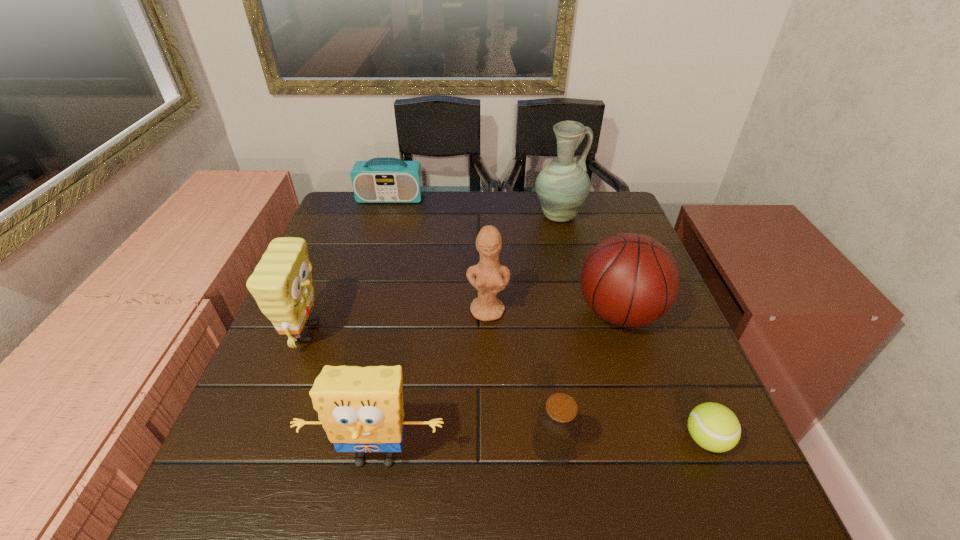
I want to click on pitcher located in the right edge section of the desktop, so [x=562, y=186].

At what (x,y) coordinates should I click in order to perform the action: click on basketball present at the right edge. Please return your answer as a coordinate pair (x, y). The height and width of the screenshot is (540, 960). Looking at the image, I should click on (628, 279).

Identify the location of tennis ball at the right edge. Image resolution: width=960 pixels, height=540 pixels. (714, 427).

I want to click on object at the far left corner, so click(x=380, y=180).

The width and height of the screenshot is (960, 540). I want to click on object at the near left corner, so click(x=361, y=409).

The width and height of the screenshot is (960, 540). I want to click on object that is at the far right corner, so tap(562, 186).

The image size is (960, 540). Find the location of `free location at the far edge`. free location at the far edge is located at coordinates (469, 227).

In the image, there is a desktop. In order to click on vacant space at the near edge in this screenshot , I will do `click(503, 527)`.

In the image, there is a desktop. Where is `vacant space at the left edge`? The width and height of the screenshot is (960, 540). vacant space at the left edge is located at coordinates (348, 333).

You are a GUI agent. You are given a task and a screenshot of the screen. Output one action in this format:
    pyautogui.click(x=<x>, y=<y>)
    Task: Click on the vacant point at the right edge
    
    Given the screenshot: What is the action you would take?
    pyautogui.click(x=689, y=350)